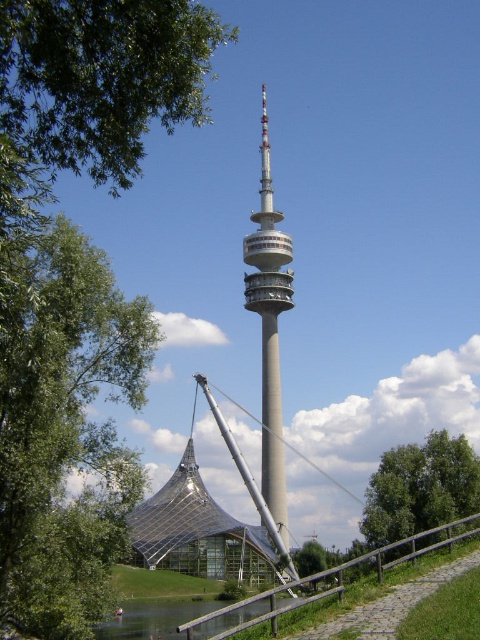
You are standing at the base of the tower and want to reach the point marked at coordinates point (140, 561). Given that your maximum walking distance is 150 meters, can you reach it without exceeding your limit?

The distance of point (140, 561) from viewer is 159.87 meters, which exceeds your maximum walking distance of 150 meters. Therefore, you cannot reach it without exceeding your limit.

You are standing in front of the scene and want to take a photo of both the transparent glass tent at center and the silver metallic tower at center. Which object should you focus on first to ensure both are in clear view?

You should focus on the transparent glass tent at center first because it is closer to the viewer than the silver metallic tower at center. By focusing on the closer object, the tower will also be in focus due to the depth of field.

You are planning to plant a new tree in this area. Considering the existing green leafy tree at left and the transparent glass tent at center, which one is taller and should be considered for spacing?

The green leafy tree at left is taller than the transparent glass tent at center, so it should be considered for spacing when planting the new tree.